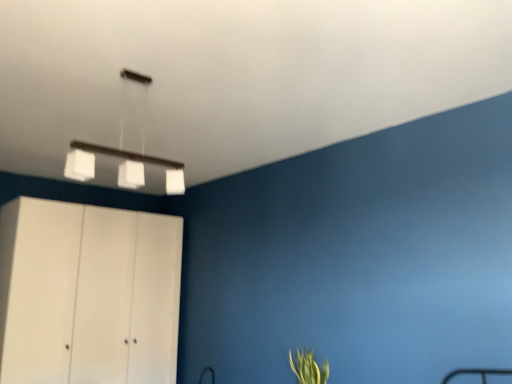
Question: Could you tell me if white matte rectangular light fixture at upper center is turned towards green leafy plant at lower right?

Choices:
 (A) no
 (B) yes

Answer: (A)

Question: Is white matte rectangular light fixture at upper center thinner than green leafy plant at lower right?

Choices:
 (A) yes
 (B) no

Answer: (A)

Question: Is white matte rectangular light fixture at upper center taller than green leafy plant at lower right?

Choices:
 (A) yes
 (B) no

Answer: (A)

Question: Is white matte rectangular light fixture at upper center far away from green leafy plant at lower right?

Choices:
 (A) yes
 (B) no

Answer: (A)

Question: Can you confirm if white matte rectangular light fixture at upper center is shorter than green leafy plant at lower right?

Choices:
 (A) no
 (B) yes

Answer: (A)

Question: Can you confirm if white matte rectangular light fixture at upper center is wider than green leafy plant at lower right?

Choices:
 (A) no
 (B) yes

Answer: (A)

Question: Is the depth of white matte rectangular light fixture at upper center greater than that of white matte cabinet at left?

Choices:
 (A) no
 (B) yes

Answer: (A)

Question: Can you confirm if white matte rectangular light fixture at upper center is taller than white matte cabinet at left?

Choices:
 (A) yes
 (B) no

Answer: (B)

Question: Could you tell me if white matte rectangular light fixture at upper center is turned towards white matte cabinet at left?

Choices:
 (A) yes
 (B) no

Answer: (A)

Question: Is white matte cabinet at left a part of white matte rectangular light fixture at upper center?

Choices:
 (A) no
 (B) yes

Answer: (A)

Question: Is white matte cabinet at left at the back of white matte rectangular light fixture at upper center?

Choices:
 (A) yes
 (B) no

Answer: (B)

Question: Is white matte rectangular light fixture at upper center beside white matte cabinet at left?

Choices:
 (A) no
 (B) yes

Answer: (A)

Question: Does white matte cabinet at left come in front of green leafy plant at lower right?

Choices:
 (A) no
 (B) yes

Answer: (A)